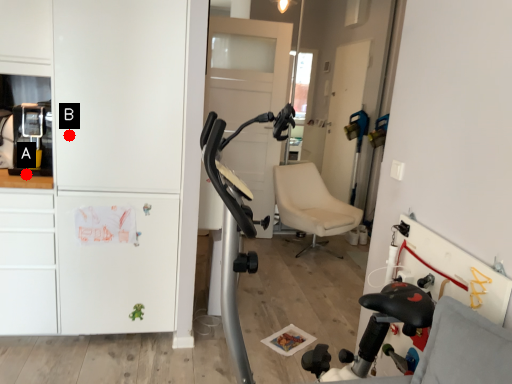
Question: Two points are circled on the image, labeled by A and B beside each circle. Which point is farther from the camera taking this photo?

Choices:
 (A) A is further
 (B) B is further

Answer: (A)